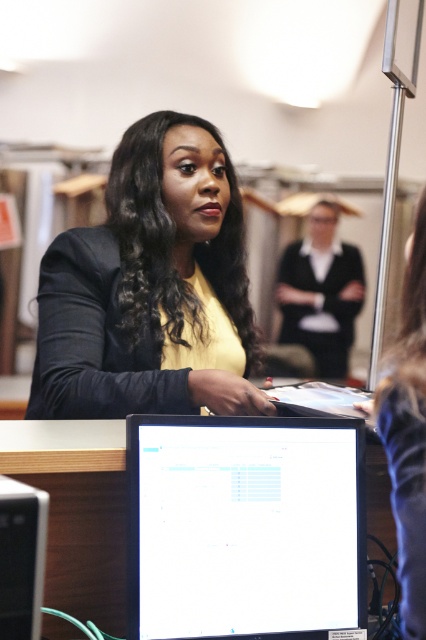
Can you confirm if matte black jacket at center is wider than black matte blazer at upper center?

Yes, matte black jacket at center is wider than black matte blazer at upper center.

Is matte black jacket at center bigger than black matte blazer at upper center?

Indeed, matte black jacket at center has a larger size compared to black matte blazer at upper center.

Based on the photo, who is more distant from viewer, (163,381) or (362,285)?

The point (362,285) is behind.

Find the location of a particular element. matte black jacket at center is located at coordinates (152, 288).

Which is above, matte black jacket at center or white glossy monitor at center?

matte black jacket at center is above.

Can you confirm if matte black jacket at center is positioned to the left of white glossy monitor at center?

Indeed, matte black jacket at center is positioned on the left side of white glossy monitor at center.

Is point (46, 320) more distant than point (143, 472)?

That is True.

Locate an element on the screen. matte black jacket at center is located at coordinates (152, 288).

Is white glossy monitor at center taller than white plastic computer tower at lower left?

Yes, white glossy monitor at center is taller than white plastic computer tower at lower left.

Does white glossy monitor at center have a lesser height compared to white plastic computer tower at lower left?

Incorrect, white glossy monitor at center's height does not fall short of white plastic computer tower at lower left's.

Locate an element on the screen. This screenshot has height=640, width=426. white glossy monitor at center is located at coordinates (244, 528).

Locate an element on the screen. white glossy monitor at center is located at coordinates (244, 528).